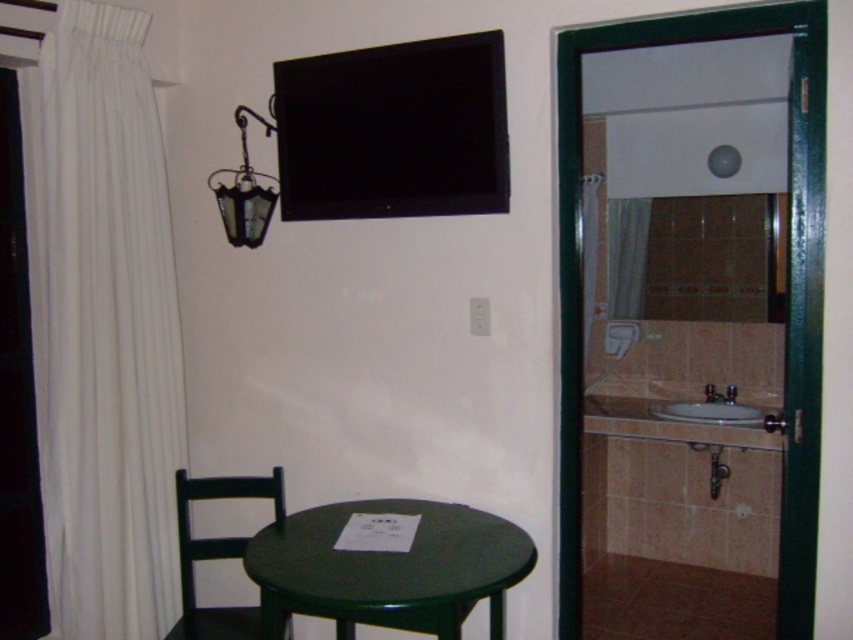
You are a plumber who needs to fix a leak under the white ceramic sink at right. To access the pipes, you must move the green glossy table at lower center. Is the table currently blocking your path to the sink?

The green glossy table at lower center is positioned on the left side of the white ceramic sink at right, so it is blocking the path to the sink. You will need to move it to access the pipes.

You are standing in the room depicted in the scene. There is a point marked at coordinates (387, 570). Based on the scene description, what object is located at this point?

The point at coordinates (387, 570) corresponds to the green glossy table at lower center.